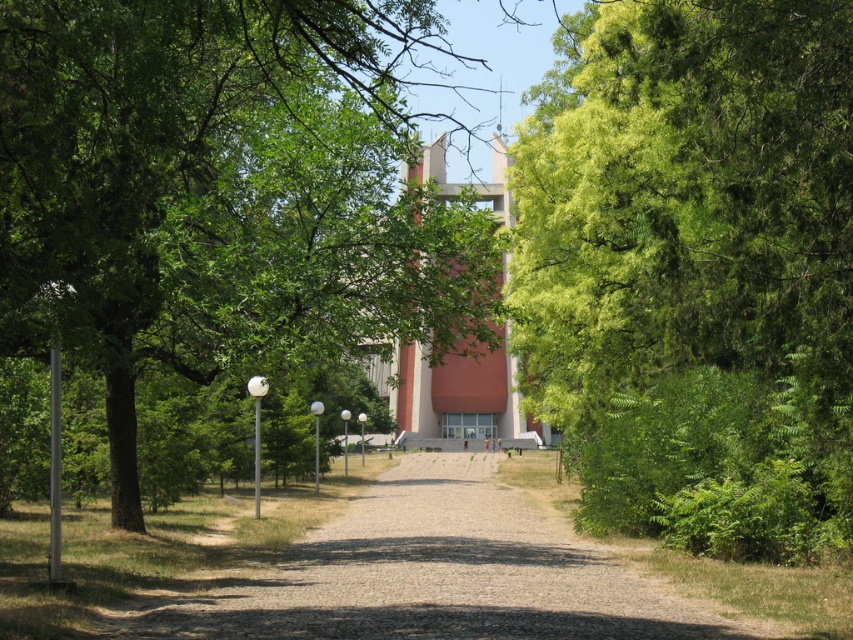
Question: Which point is farther to the camera?

Choices:
 (A) green leafy tree at right
 (B) gravel driveway at center

Answer: (A)

Question: Which point appears farthest from the camera in this image?

Choices:
 (A) (164, 328)
 (B) (664, 445)
 (C) (281, 579)

Answer: (B)

Question: Which point is farther to the camera?

Choices:
 (A) green leafy tree at center
 (B) gravel driveway at center
 (C) green leafy tree at right

Answer: (C)

Question: Is green leafy tree at center in front of gravel driveway at center?

Choices:
 (A) no
 (B) yes

Answer: (B)

Question: Is green leafy tree at center positioned behind gravel driveway at center?

Choices:
 (A) no
 (B) yes

Answer: (A)

Question: Does green leafy tree at center appear under gravel driveway at center?

Choices:
 (A) no
 (B) yes

Answer: (A)